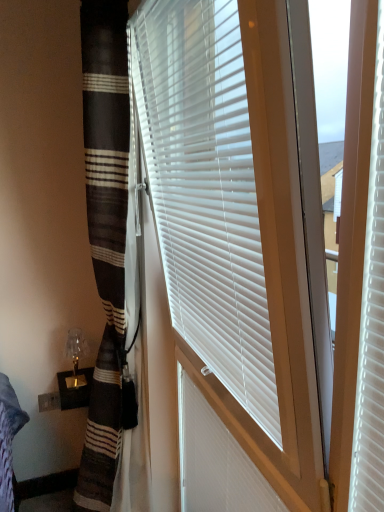
Question: Looking at their shapes, would you say white plastic blinds at center is wider or thinner than translucent glass table lamp at lower left?

Choices:
 (A) thin
 (B) wide

Answer: (A)

Question: Considering the positions of white plastic blinds at center and translucent glass table lamp at lower left in the image, is white plastic blinds at center taller or shorter than translucent glass table lamp at lower left?

Choices:
 (A) short
 (B) tall

Answer: (B)

Question: Considering the real-world distances, which object is closest to the white plastic blinds at center?

Choices:
 (A) white plastic shutter at center
 (B) translucent glass table lamp at lower left

Answer: (A)

Question: Which object is the farthest from the white plastic shutter at center?

Choices:
 (A) translucent glass table lamp at lower left
 (B) white plastic blinds at center

Answer: (A)